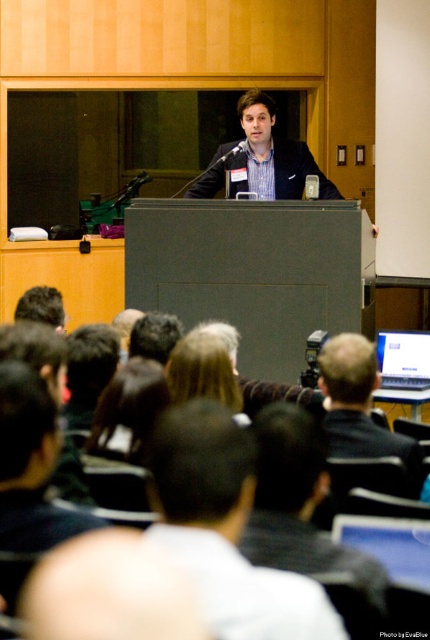
Does black fabric jacket at center appear on the right side of blonde hair at center?

Yes, black fabric jacket at center is to the right of blonde hair at center.

Between point (362, 589) and point (230, 404), which one is positioned behind?

The point (230, 404) is more distant.

At what (x,y) coordinates should I click in order to perform the action: click on black fabric jacket at center. Please return your answer as a coordinate pair (x, y). The image size is (430, 640). Looking at the image, I should click on (304, 515).

Is dark brown hair at lower left above blue striped shirt at center?

Actually, dark brown hair at lower left is below blue striped shirt at center.

Does point (5, 531) come closer to viewer compared to point (267, 164)?

Yes.

Which is in front, point (9, 538) or point (264, 138)?

Positioned in front is point (9, 538).

You are a GUI agent. You are given a task and a screenshot of the screen. Output one action in this format:
    pyautogui.click(x=<x>, y=<y>)
    Task: Click on the dark brown hair at lower left
    This screenshot has width=430, height=640.
    Given the screenshot: What is the action you would take?
    pyautogui.click(x=30, y=465)

Is black fabric shirt at lower center taller than dark brown hair at center?

Yes.

In order to click on black fabric shirt at lower center in this screenshot , I will do `click(226, 529)`.

Locate an element on the screen. black fabric shirt at lower center is located at coordinates (226, 529).

You are a GUI agent. You are given a task and a screenshot of the screen. Output one action in this format:
    pyautogui.click(x=<x>, y=<y>)
    Task: Click on the black fabric shirt at lower center
    This screenshot has height=640, width=430.
    Given the screenshot: What is the action you would take?
    pyautogui.click(x=226, y=529)